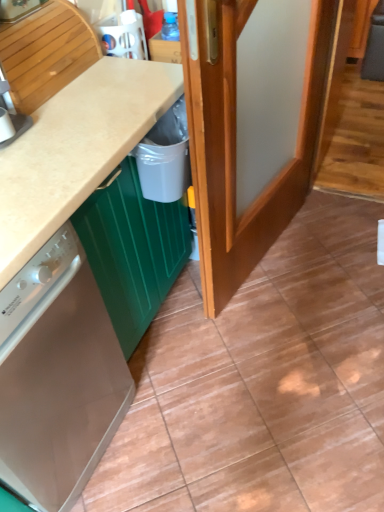
I want to click on vacant space underneath satin white dishwasher at lower left (from a real-world perspective), so click(x=46, y=428).